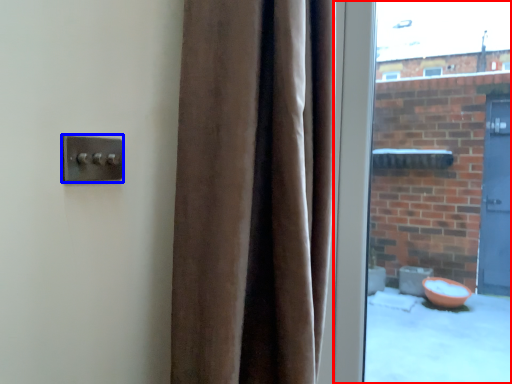
Question: Which point is further to the camera, window (highlighted by a red box) or door handle (highlighted by a blue box)?

Choices:
 (A) window
 (B) door handle

Answer: (A)